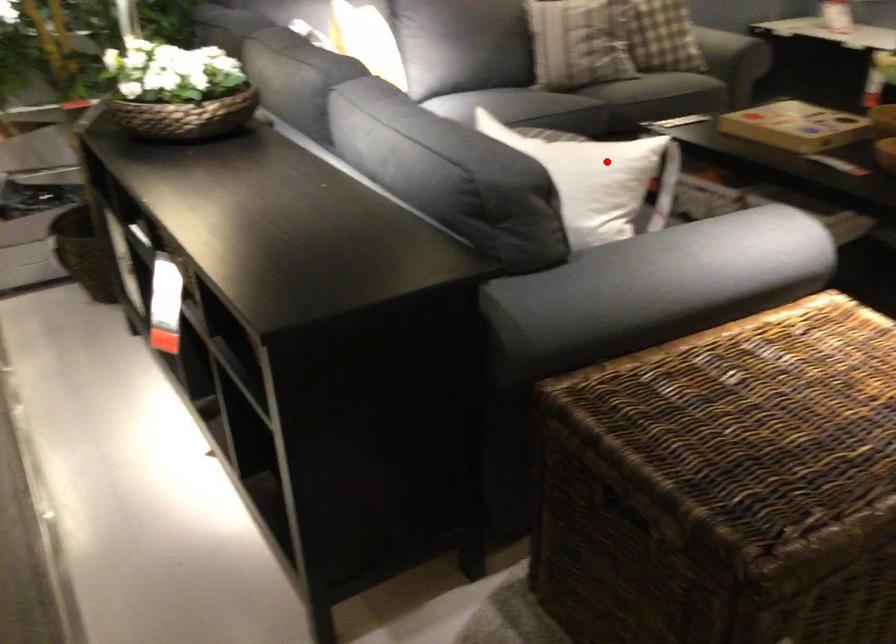
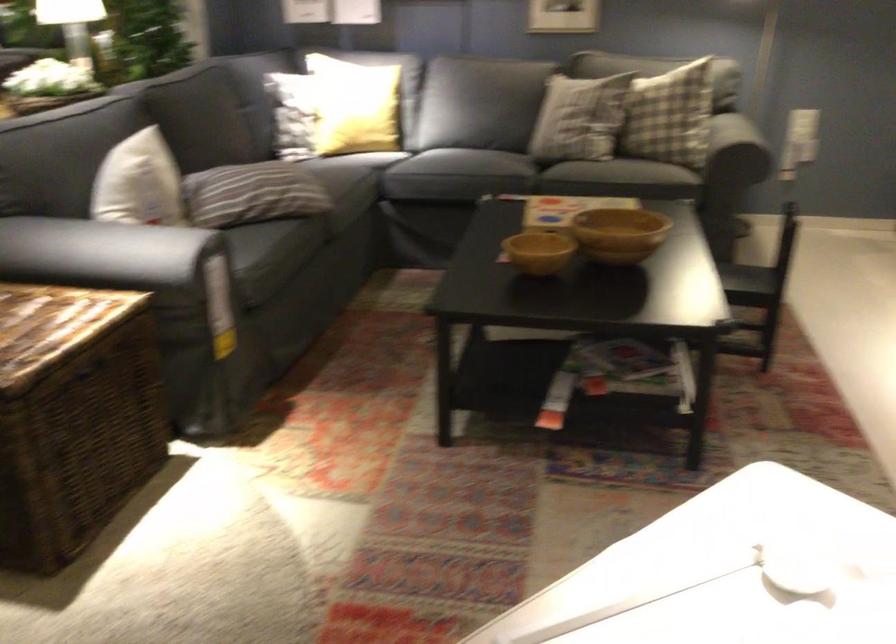
Find the pixel in the second image that matches the highlighted location in the first image.

(139, 183)